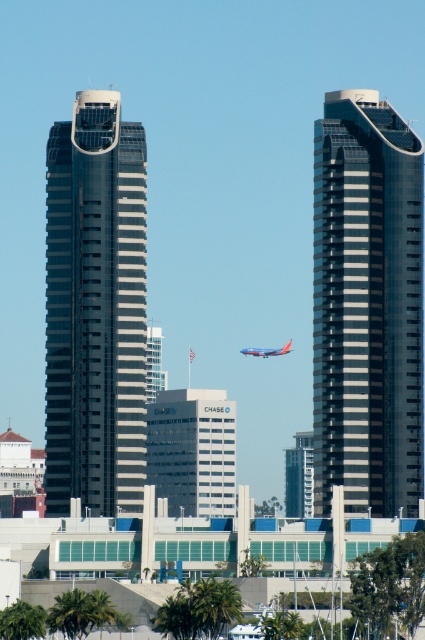
You are standing on the sidewalk in front of the cityscape and want to take a photo of the smooth glass skyscraper at right without the metallic silver elevator shaft at center blocking the view. Is this possible?

The smooth glass skyscraper at right is located above the metallic silver elevator shaft at center, so if you position yourself lower or adjust your angle to look upward, you can capture the skyscraper without the elevator shaft blocking the view.

You are standing at the center of the city square and want to take a photo of the smooth glass skyscraper at right. Where should you position yourself to ensure it fits perfectly in your camera frame?

To capture the smooth glass skyscraper at right in your camera frame, position yourself at the center of the city square since the skyscraper is located at coordinate point (367,305), which is within the typical camera frame range when centered.

You are a city planner assessing the space between the smooth glass skyscraper at right and the metallic silver elevator shaft at center. If you need to install a temporary walkway that must be at least 80 feet long to connect them, will it be feasible?

The distance between the smooth glass skyscraper at right and the metallic silver elevator shaft at center is 81.37 feet, which exceeds the required 80 feet. Therefore, the temporary walkway can be installed as planned.